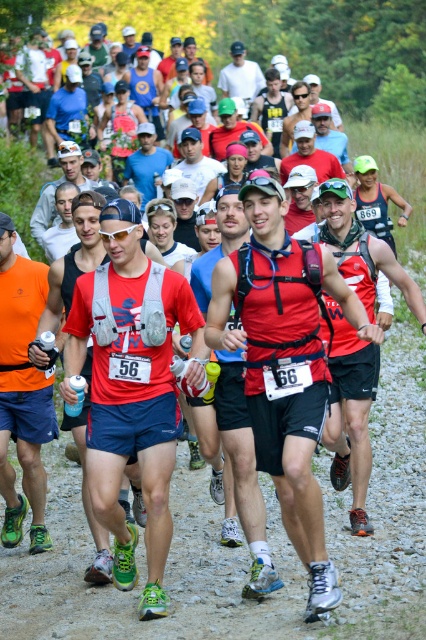
Who is more forward, (239, 192) or (137, 104)?

Positioned in front is point (239, 192).

Which is in front, point (311, 540) or point (157, 76)?

Point (311, 540) is more forward.

The height and width of the screenshot is (640, 426). What are the coordinates of `matte red tank top at center` in the screenshot? It's located at (284, 364).

Does white matte cap at center appear on the left side of matte blue tank top at center?

In fact, white matte cap at center is to the right of matte blue tank top at center.

How far apart are white matte cap at center and matte blue tank top at center?

A distance of 26.64 feet exists between white matte cap at center and matte blue tank top at center.

What do you see at coordinates (198, 163) in the screenshot?
I see `white matte cap at center` at bounding box center [198, 163].

Find the location of a particular element. The height and width of the screenshot is (640, 426). white matte cap at center is located at coordinates (198, 163).

Is point (43, 413) less distant than point (138, 163)?

Yes, point (43, 413) is closer to viewer.

Is matte orange tank top at center thinner than matte gray vest at center?

Indeed, matte orange tank top at center has a lesser width compared to matte gray vest at center.

Is point (6, 364) in front of point (143, 193)?

Yes, it is.

This screenshot has height=640, width=426. Find the location of `matte orange tank top at center`. matte orange tank top at center is located at coordinates (23, 392).